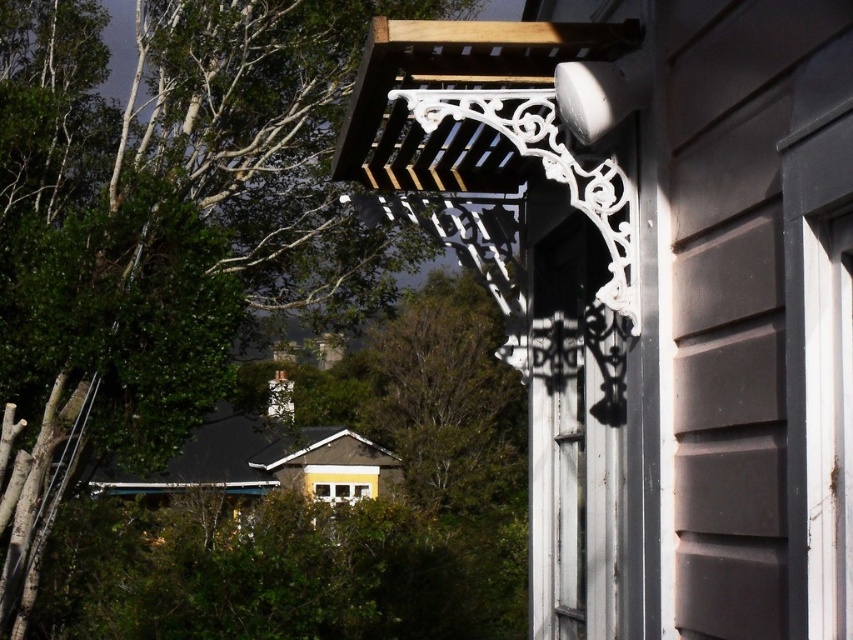
You are standing in front of the building with the brown siding. Looking at the scene, where is the green leafy tree at upper left located in terms of direction and position relative to the building?

The green leafy tree at upper left is located at the upper left corner of the scene, positioned to the left and above the building with brown siding.